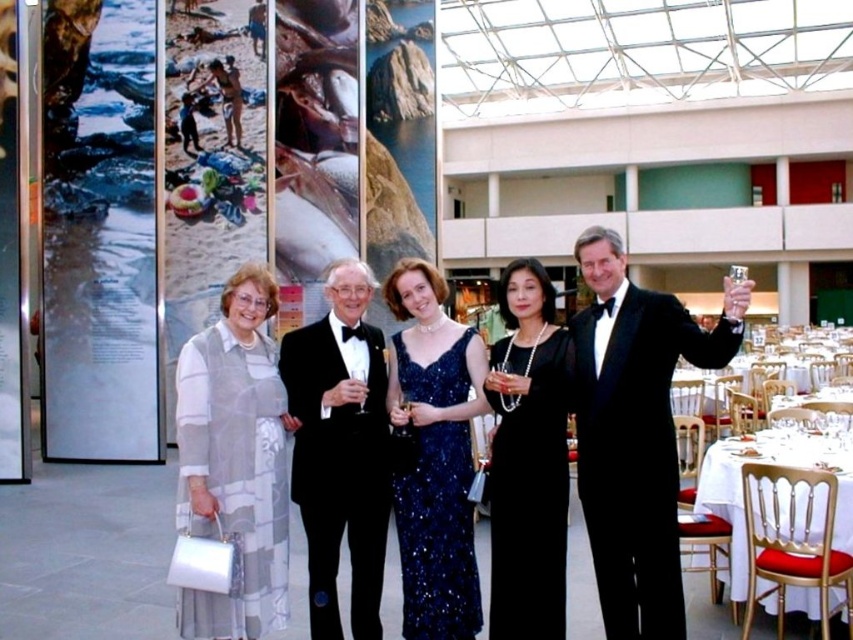
Question: Is black velvet tuxedo at right bigger than black satin dress at center?

Choices:
 (A) no
 (B) yes

Answer: (B)

Question: Is black velvet tuxedo at right to the left of black satin tuxedo at center from the viewer's perspective?

Choices:
 (A) no
 (B) yes

Answer: (A)

Question: Considering the real-world distances, which object is closest to the black satin tuxedo at center?

Choices:
 (A) black satin dress at center
 (B) navy sequined dress at center

Answer: (B)

Question: Considering the real-world distances, which object is closest to the black velvet tuxedo at right?

Choices:
 (A) white cloth at lower right
 (B) black satin tuxedo at center
 (C) black satin dress at center
 (D) navy sequined dress at center

Answer: (C)

Question: Which of the following is the farthest from the observer?

Choices:
 (A) black satin tuxedo at center
 (B) white cloth at lower right
 (C) black satin dress at center

Answer: (A)

Question: Is black velvet tuxedo at right smaller than white sheer dress at left?

Choices:
 (A) no
 (B) yes

Answer: (A)